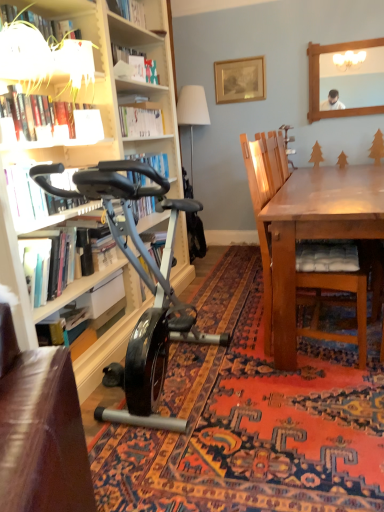
Where is `vacant space to the right of shiny black exercise bike at left`? This screenshot has width=384, height=512. vacant space to the right of shiny black exercise bike at left is located at coordinates (290, 411).